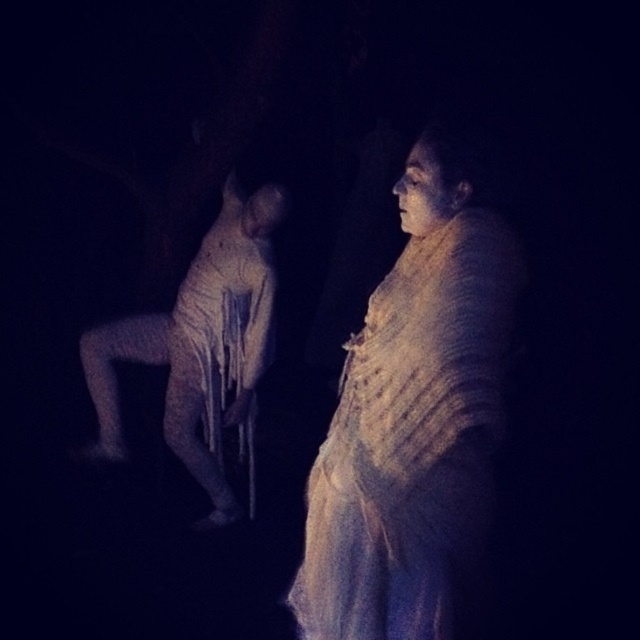
Question: Is white textured dress at center thinner than white textured crutches at left?

Choices:
 (A) yes
 (B) no

Answer: (A)

Question: Observing the image, what is the correct spatial positioning of white textured dress at center in reference to white textured crutches at left?

Choices:
 (A) left
 (B) right

Answer: (B)

Question: Which point appears closest to the camera in this image?

Choices:
 (A) (493, 356)
 (B) (193, 323)

Answer: (A)

Question: Among these objects, which one is nearest to the camera?

Choices:
 (A) white textured dress at center
 (B) white textured crutches at left

Answer: (A)

Question: Can you confirm if white textured dress at center is smaller than white textured crutches at left?

Choices:
 (A) no
 (B) yes

Answer: (B)